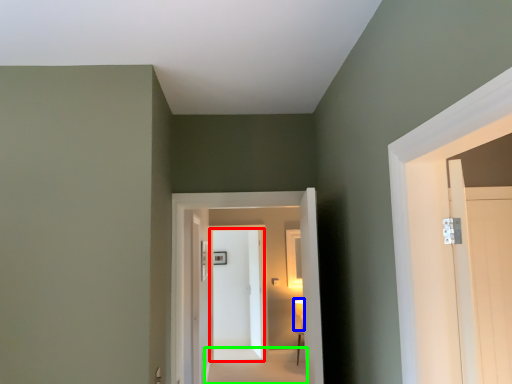
Question: Based on their relative distances, which object is farther from door (highlighted by a red box)? Choose from light fixture (highlighted by a blue box) and path (highlighted by a green box).

Choices:
 (A) light fixture
 (B) path

Answer: (A)